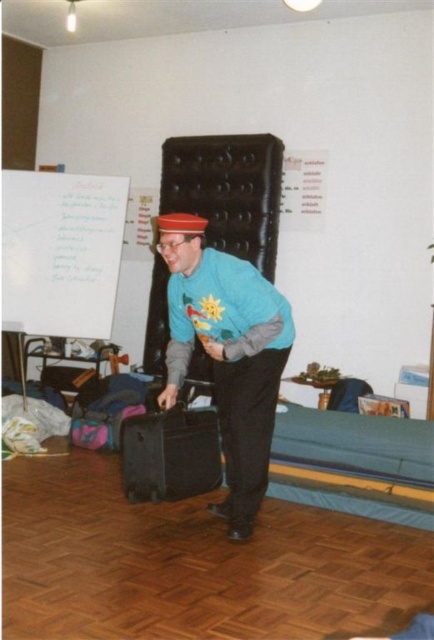
Is point (223, 401) more distant than point (95, 196)?

No, it is in front of (95, 196).

Who is higher up, matte blue sweater at center or white paper at upper left?

white paper at upper left

Which is in front, point (276, 356) or point (45, 221)?

Point (276, 356) is more forward.

At what (x,y) coordinates should I click in order to perform the action: click on matte blue sweater at center. Please return your answer as a coordinate pair (x, y). This screenshot has height=640, width=434. Looking at the image, I should click on (226, 353).

Does white paper at upper left lie behind black hard suitcase at center?

Yes, it is.

From the picture: Is white paper at upper left shorter than black hard suitcase at center?

In fact, white paper at upper left may be taller than black hard suitcase at center.

Which is behind, point (95, 284) or point (214, 412)?

Point (95, 284)

Where is `white paper at upper left`? The height and width of the screenshot is (640, 434). white paper at upper left is located at coordinates (61, 252).

Is matte blue sweater at center to the left of black hard suitcase at center from the viewer's perspective?

In fact, matte blue sweater at center is to the right of black hard suitcase at center.

Is point (276, 353) positioned behind point (184, 435)?

That is False.

Image resolution: width=434 pixels, height=640 pixels. In order to click on matte blue sweater at center in this screenshot , I will do pos(226,353).